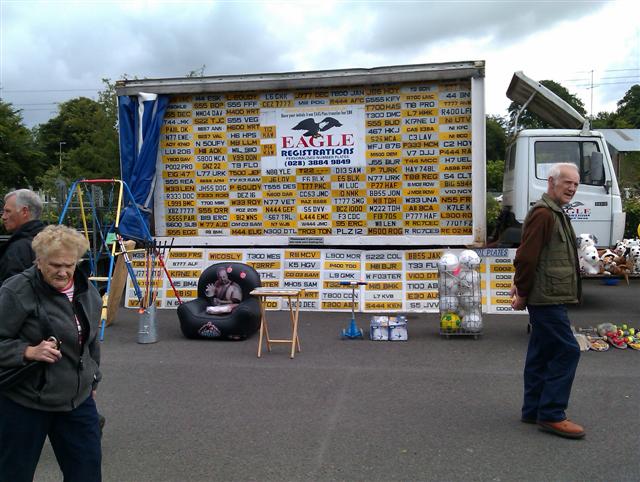
Where is `card table`? Image resolution: width=640 pixels, height=482 pixels. card table is located at coordinates (278, 290).